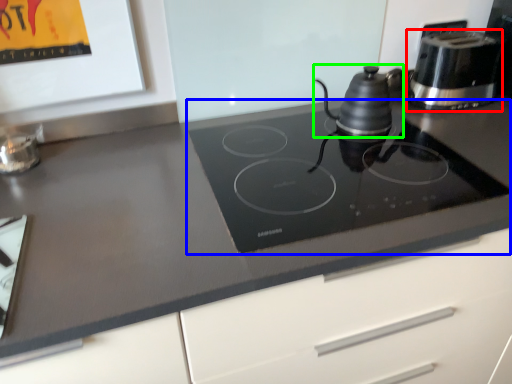
Question: Estimate the real-world distances between objects in this image. Which object is closer to kitchen appliance (highlighted by a red box), gas stove (highlighted by a blue box) or kitchen appliance (highlighted by a green box)?

Choices:
 (A) gas stove
 (B) kitchen appliance

Answer: (B)